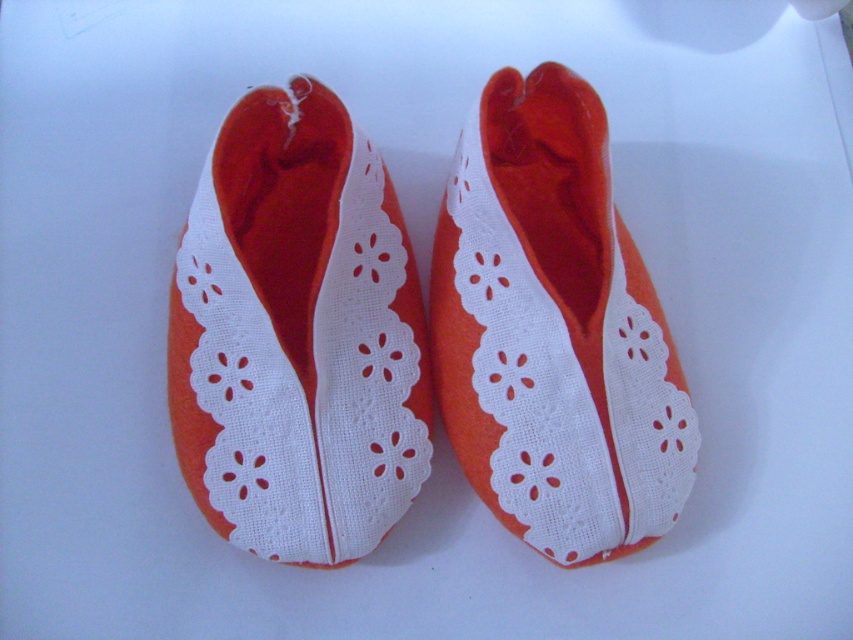
Question: Which object is farther from the camera taking this photo?

Choices:
 (A) orange fabric shoe at center
 (B) orange felt slipper at center

Answer: (B)

Question: In this image, where is orange fabric shoe at center located relative to orange felt slipper at center?

Choices:
 (A) below
 (B) above

Answer: (A)

Question: Is orange fabric shoe at center below orange felt slipper at center?

Choices:
 (A) yes
 (B) no

Answer: (A)

Question: Where is orange fabric shoe at center located in relation to orange felt slipper at center in the image?

Choices:
 (A) below
 (B) above

Answer: (A)

Question: Which point is closer to the camera?

Choices:
 (A) orange fabric shoe at center
 (B) orange felt slipper at center

Answer: (A)